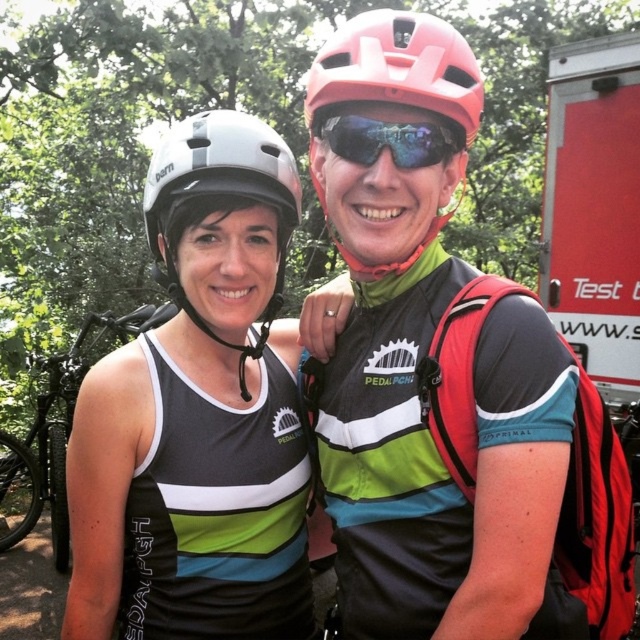
Based on the photo, who is more forward, (314, 154) or (369, 90)?

Point (369, 90) is more forward.

Between matte pink helmet at center and matte pink helmet at upper center, which one has more height?

Standing taller between the two is matte pink helmet at center.

This screenshot has height=640, width=640. What do you see at coordinates (397, 67) in the screenshot?
I see `matte pink helmet at center` at bounding box center [397, 67].

Where is `matte pink helmet at center`? matte pink helmet at center is located at coordinates (397, 67).

What do you see at coordinates (220, 198) in the screenshot? This screenshot has height=640, width=640. I see `white matte helmet at upper left` at bounding box center [220, 198].

This screenshot has width=640, height=640. What are the coordinates of `white matte helmet at upper left` in the screenshot? It's located at (220, 198).

Does matte black helmet at center lie behind white matte helmet at upper left?

No, matte black helmet at center is in front of white matte helmet at upper left.

Image resolution: width=640 pixels, height=640 pixels. Find the location of `matte black helmet at center`. matte black helmet at center is located at coordinates (198, 412).

Which is behind, point (216, 490) or point (192, 125)?

The point (216, 490) is behind.

Identify the location of matte black helmet at center. (198, 412).